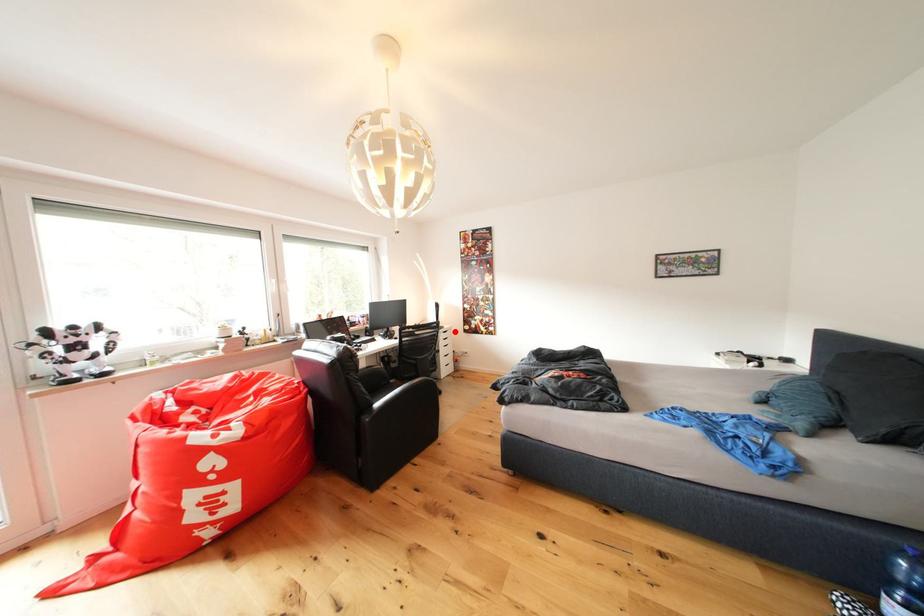
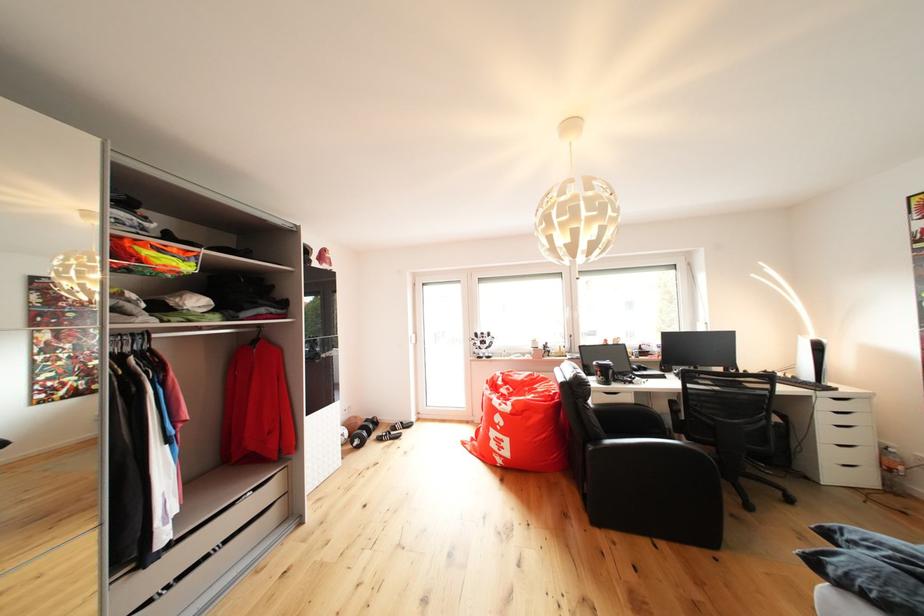
Question: I am providing you with two images of the same scene from different viewpoints. Given a red point in image1, look at the same physical point in image2. Is it:

Choices:
 (A) Closer to the viewpoint
 (B) Farther from the viewpoint

Answer: (A)